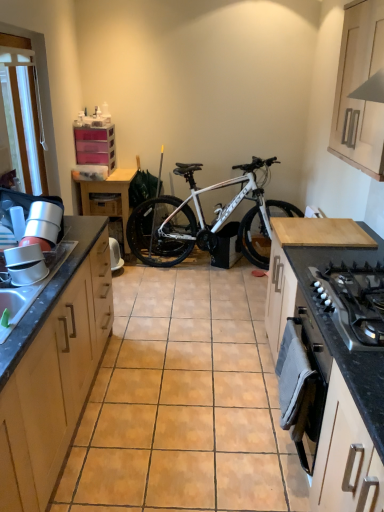
Where is `free space to the left of black granite countertop at lower right`? This screenshot has height=512, width=384. free space to the left of black granite countertop at lower right is located at coordinates (233, 453).